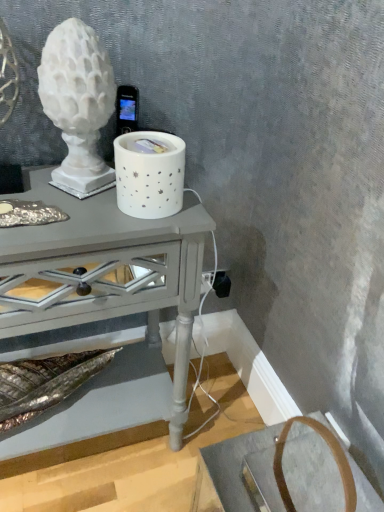
The image size is (384, 512). What do you see at coordinates (149, 174) in the screenshot?
I see `white ceramic candle holder at center, the second candle holder viewed from the left` at bounding box center [149, 174].

Identify the location of white ceramic candle holder at center, the second candle holder viewed from the left. (149, 174).

Describe the element at coordinates (101, 300) in the screenshot. I see `matte gray table at center` at that location.

The height and width of the screenshot is (512, 384). Find the location of `white matte sculpture at upper left, the 2th candle holder positioned from the right`. white matte sculpture at upper left, the 2th candle holder positioned from the right is located at coordinates pyautogui.click(x=78, y=104).

Is the depth of white matte sculpture at upper left, the 2th candle holder positioned from the right, less than that of black plastic outlet at lower right?

Yes, the depth of white matte sculpture at upper left, the 2th candle holder positioned from the right, is less than that of black plastic outlet at lower right.

Between white matte sculpture at upper left, the first candle holder when ordered from left to right, and black plastic outlet at lower right, which one has smaller width?

black plastic outlet at lower right.

Between white matte sculpture at upper left, the 2th candle holder positioned from the right, and black plastic outlet at lower right, which one appears on the left side from the viewer's perspective?

white matte sculpture at upper left, the 2th candle holder positioned from the right.

From the image's perspective, which one is positioned higher, white ceramic candle holder at center, the 1th candle holder positioned from the right, or black plastic outlet at lower right?

From the image's view, white ceramic candle holder at center, the 1th candle holder positioned from the right, is above.

Which object is more forward, white ceramic candle holder at center, the second candle holder viewed from the left, or black plastic outlet at lower right?

white ceramic candle holder at center, the second candle holder viewed from the left, is more forward.

Considering the positions of point (159, 144) and point (226, 294), is point (159, 144) closer or farther from the camera than point (226, 294)?

Point (159, 144).

Is white ceramic candle holder at center, the 1th candle holder positioned from the right, shorter than black plastic outlet at lower right?

No.

Which point is more distant from viewer, (125, 137) or (4, 268)?

The point (125, 137) is behind.

How far apart are white ceramic candle holder at center, the second candle holder viewed from the left, and matte gray table at center?

They are 10.91 inches apart.

Consider the image. Would you say white ceramic candle holder at center, the 1th candle holder positioned from the right, is inside or outside matte gray table at center?

white ceramic candle holder at center, the 1th candle holder positioned from the right, is not enclosed by matte gray table at center.

The image size is (384, 512). I want to click on the 1st candle holder positioned above the matte gray table at center (from the image's perspective), so click(x=149, y=174).

Which object is wider, matte gray table at center or white matte sculpture at upper left, the 2th candle holder positioned from the right?

Wider between the two is matte gray table at center.

Image resolution: width=384 pixels, height=512 pixels. In order to click on the 2nd candle holder directly above the matte gray table at center (from a real-world perspective) in this screenshot , I will do `click(78, 104)`.

In the scene shown: Is white matte sculpture at upper left, the 2th candle holder positioned from the right, located within matte gray table at center?

Definitely not — white matte sculpture at upper left, the 2th candle holder positioned from the right, is not inside matte gray table at center.

Looking at this image, considering the relative positions of matte gray table at center and white matte sculpture at upper left, the 2th candle holder positioned from the right, in the image provided, is matte gray table at center to the left of white matte sculpture at upper left, the 2th candle holder positioned from the right, from the viewer's perspective?

Yes, matte gray table at center is to the left of white matte sculpture at upper left, the 2th candle holder positioned from the right.

The height and width of the screenshot is (512, 384). In order to click on candle holder positioned vertically above the white ceramic candle holder at center, the 1th candle holder positioned from the right (from a real-world perspective) in this screenshot , I will do `click(78, 104)`.

From the image's perspective, which object appears higher, white matte sculpture at upper left, the first candle holder when ordered from left to right, or white ceramic candle holder at center, the 1th candle holder positioned from the right?

white matte sculpture at upper left, the first candle holder when ordered from left to right.

Is white matte sculpture at upper left, the 2th candle holder positioned from the right, positioned with its back to white ceramic candle holder at center, the second candle holder viewed from the left?

No, white matte sculpture at upper left, the 2th candle holder positioned from the right, is not facing away from white ceramic candle holder at center, the second candle holder viewed from the left.

Based on the photo, in terms of size, does black plastic outlet at lower right appear bigger or smaller than white matte sculpture at upper left, the first candle holder when ordered from left to right?

Considering their sizes, black plastic outlet at lower right takes up less space than white matte sculpture at upper left, the first candle holder when ordered from left to right.

Which object is closer to the camera, black plastic outlet at lower right or white matte sculpture at upper left, the first candle holder when ordered from left to right?

white matte sculpture at upper left, the first candle holder when ordered from left to right, is closer to the camera.

Is point (229, 292) closer to viewer compared to point (103, 58)?

No, (229, 292) is further to viewer.

Would you say matte gray table at center is to the left or to the right of black plastic outlet at lower right in the picture?

From the image, it's evident that matte gray table at center is to the left of black plastic outlet at lower right.

From the image's perspective, which one is positioned higher, matte gray table at center or black plastic outlet at lower right?

black plastic outlet at lower right.

Is matte gray table at center taller or shorter than black plastic outlet at lower right?

In the image, matte gray table at center appears to be taller than black plastic outlet at lower right.

Is matte gray table at center far from black plastic outlet at lower right?

No, matte gray table at center is in close proximity to black plastic outlet at lower right.

At what (x,y) coordinates should I click in order to perform the action: click on electric outlet on the right of white matte sculpture at upper left, the first candle holder when ordered from left to right. Please return your answer as a coordinate pair (x, y). Image resolution: width=384 pixels, height=512 pixels. Looking at the image, I should click on (222, 284).

You are a GUI agent. You are given a task and a screenshot of the screen. Output one action in this format:
    pyautogui.click(x=<x>, y=<y>)
    Task: Click on the electric outlet behind the white ceramic candle holder at center, the second candle holder viewed from the left
    This screenshot has width=384, height=512.
    Given the screenshot: What is the action you would take?
    pyautogui.click(x=222, y=284)

Looking at the image, which one is located closer to matte gray table at center, black plastic outlet at lower right or white ceramic candle holder at center, the second candle holder viewed from the left?

white ceramic candle holder at center, the second candle holder viewed from the left, is closer to matte gray table at center.

Based on their spatial positions, is black plastic outlet at lower right or matte gray table at center closer to white matte sculpture at upper left, the 2th candle holder positioned from the right?

matte gray table at center.

From the image, which object appears to be nearer to white ceramic candle holder at center, the 1th candle holder positioned from the right, matte gray table at center or white matte sculpture at upper left, the 2th candle holder positioned from the right?

white matte sculpture at upper left, the 2th candle holder positioned from the right, lies closer to white ceramic candle holder at center, the 1th candle holder positioned from the right, than the other object.

From the image, which object appears to be nearer to matte gray table at center, white ceramic candle holder at center, the 1th candle holder positioned from the right, or white matte sculpture at upper left, the 2th candle holder positioned from the right?

white ceramic candle holder at center, the 1th candle holder positioned from the right.

In the scene shown: From the image, which object appears to be farther from black plastic outlet at lower right, white matte sculpture at upper left, the first candle holder when ordered from left to right, or white ceramic candle holder at center, the 1th candle holder positioned from the right?

white matte sculpture at upper left, the first candle holder when ordered from left to right, lies further to black plastic outlet at lower right than the other object.

Looking at the image, which one is located closer to matte gray table at center, black plastic outlet at lower right or white matte sculpture at upper left, the first candle holder when ordered from left to right?

white matte sculpture at upper left, the first candle holder when ordered from left to right, is closer to matte gray table at center.

Estimate the real-world distances between objects in this image. Which object is closer to white ceramic candle holder at center, the second candle holder viewed from the left, white matte sculpture at upper left, the first candle holder when ordered from left to right, or black plastic outlet at lower right?

white matte sculpture at upper left, the first candle holder when ordered from left to right, is positioned closer to the anchor white ceramic candle holder at center, the second candle holder viewed from the left.

Looking at the image, which one is located further to matte gray table at center, white ceramic candle holder at center, the second candle holder viewed from the left, or black plastic outlet at lower right?

Based on the image, black plastic outlet at lower right appears to be further to matte gray table at center.

In order to click on candle holder between white matte sculpture at upper left, the first candle holder when ordered from left to right, and black plastic outlet at lower right from front to back in this screenshot , I will do `click(149, 174)`.

Where is `candle holder between white matte sculpture at upper left, the first candle holder when ordered from left to right, and matte gray table at center in the up-down direction`? The image size is (384, 512). candle holder between white matte sculpture at upper left, the first candle holder when ordered from left to right, and matte gray table at center in the up-down direction is located at coordinates (149, 174).